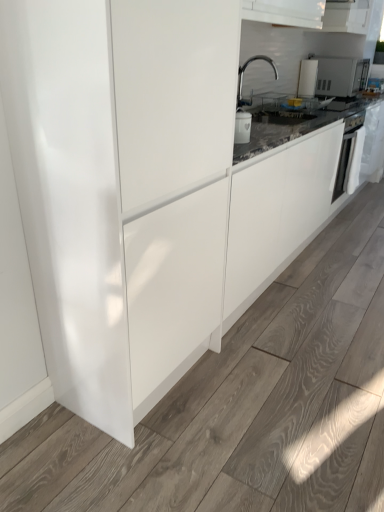
Question: Is white glossy oven at right far from glossy white cabinet at center?

Choices:
 (A) no
 (B) yes

Answer: (B)

Question: From a real-world perspective, is white glossy oven at right located beneath glossy white cabinet at center?

Choices:
 (A) no
 (B) yes

Answer: (B)

Question: From the image's perspective, is white glossy oven at right on top of glossy white cabinet at center?

Choices:
 (A) no
 (B) yes

Answer: (B)

Question: Can you confirm if white glossy oven at right is thinner than glossy white cabinet at center?

Choices:
 (A) yes
 (B) no

Answer: (A)

Question: Does white glossy oven at right have a greater width compared to glossy white cabinet at center?

Choices:
 (A) no
 (B) yes

Answer: (A)

Question: Is white glossy oven at right turned away from glossy white cabinet at center?

Choices:
 (A) yes
 (B) no

Answer: (B)

Question: Is the depth of white glossy microwave at upper right greater than that of polished chrome faucet at upper center?

Choices:
 (A) no
 (B) yes

Answer: (B)

Question: Considering the relative sizes of white glossy microwave at upper right and polished chrome faucet at upper center in the image provided, is white glossy microwave at upper right shorter than polished chrome faucet at upper center?

Choices:
 (A) yes
 (B) no

Answer: (A)

Question: From the image's perspective, is white glossy microwave at upper right beneath polished chrome faucet at upper center?

Choices:
 (A) yes
 (B) no

Answer: (B)

Question: From the image's perspective, is white glossy microwave at upper right on top of polished chrome faucet at upper center?

Choices:
 (A) no
 (B) yes

Answer: (B)

Question: Is polished chrome faucet at upper center surrounded by white glossy microwave at upper right?

Choices:
 (A) yes
 (B) no

Answer: (B)

Question: Is white glossy microwave at upper right smaller than polished chrome faucet at upper center?

Choices:
 (A) no
 (B) yes

Answer: (A)

Question: Are white glossy microwave at upper right and white glossy microwave at upper right making contact?

Choices:
 (A) yes
 (B) no

Answer: (B)